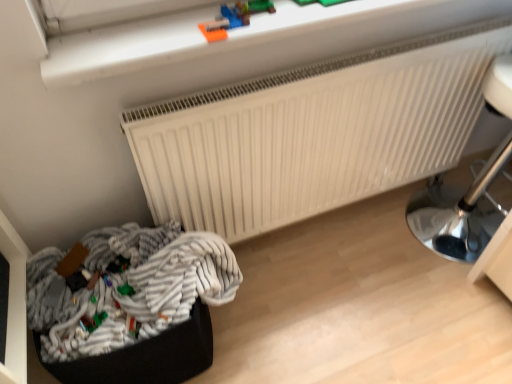
Question: Looking at the image, does green plastic toy at lower left, which ranks as the first toy in left-to-right order, seem bigger or smaller compared to green matte toy at lower left, the second toy from the top?

Choices:
 (A) big
 (B) small

Answer: (A)

Question: Is green plastic toy at lower left, arranged as the 3th toy when viewed from the top, wider or thinner than green matte toy at lower left, the second toy ordered from the bottom?

Choices:
 (A) wide
 (B) thin

Answer: (A)

Question: Which of these objects is positioned closest to the metallic silver lamp at right?

Choices:
 (A) smooth plastic toy at upper center, the first toy viewed from the right
 (B) green matte toy at lower left, which is the second toy from right to left
 (C) white matte radiator at upper center
 (D) striped fabric laundry at lower left
 (E) green plastic toy at lower left, the first toy when ordered from bottom to top

Answer: (C)

Question: Which is nearer to the smooth plastic toy at upper center, which ranks as the first toy in top-to-bottom order?

Choices:
 (A) green plastic toy at lower left, arranged as the 3th toy when viewed from the top
 (B) white matte radiator at upper center
 (C) metallic silver lamp at right
 (D) striped fabric laundry at lower left
 (E) green matte toy at lower left, which is counted as the second toy, starting from the left

Answer: (B)